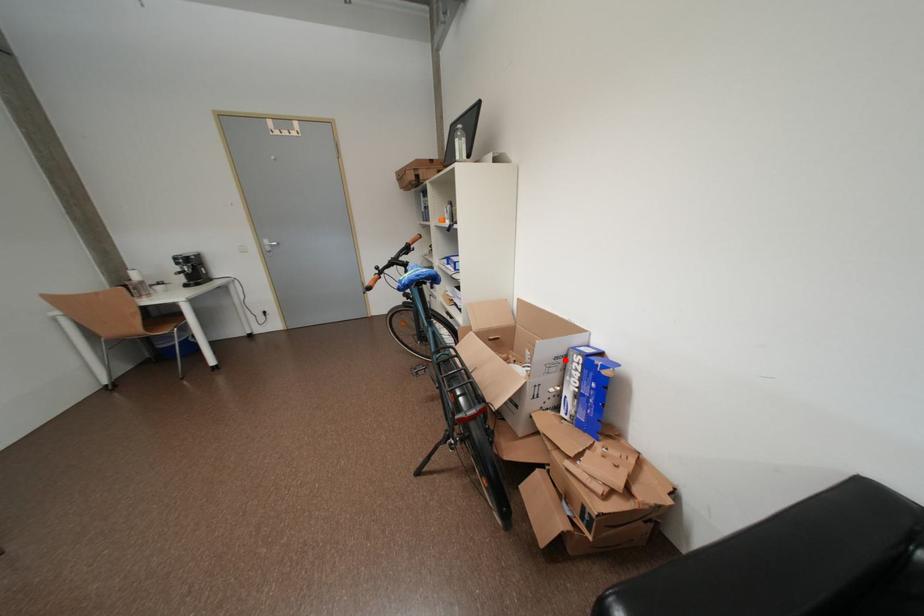
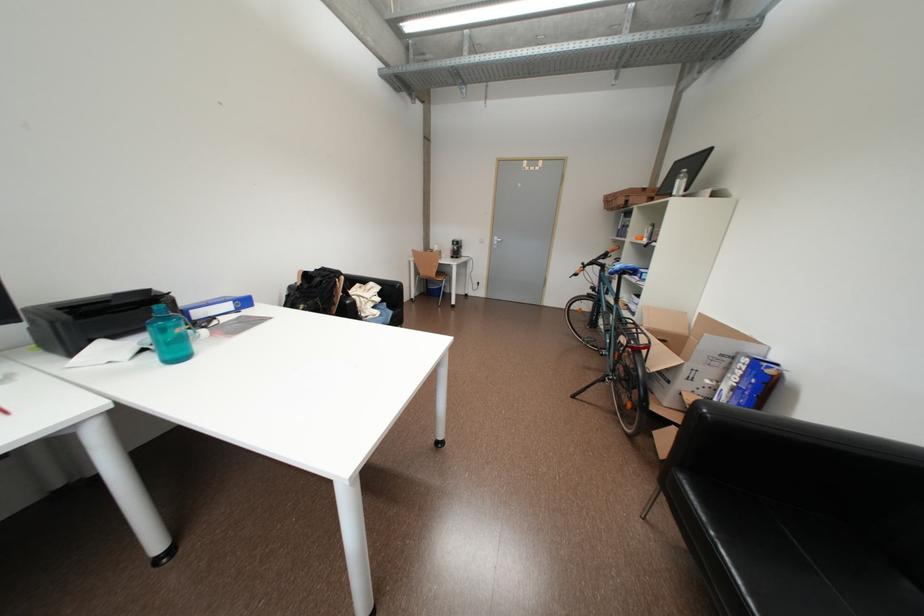
Question: I am providing you with two images of the same scene from different viewpoints. Given a red point in image1, look at the same physical point in image2. Is it:

Choices:
 (A) Closer to the viewpoint
 (B) Farther from the viewpoint

Answer: (A)